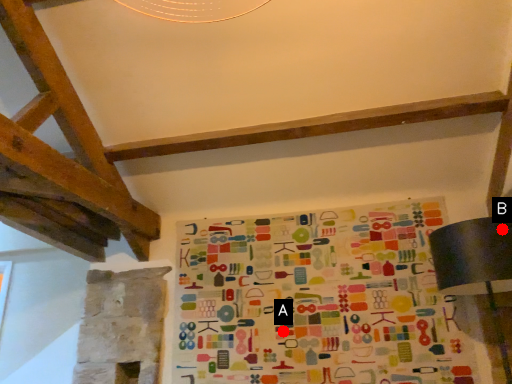
Question: Two points are circled on the image, labeled by A and B beside each circle. Which of the following is the closest to the observer?

Choices:
 (A) A is closer
 (B) B is closer

Answer: (B)